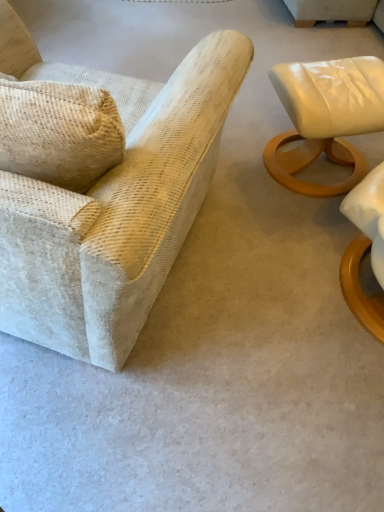
Identify the location of vacant area that lies to the right of textured beige armchair at left, arranged as the 1th chair when viewed from the left. Image resolution: width=384 pixels, height=512 pixels. (273, 285).